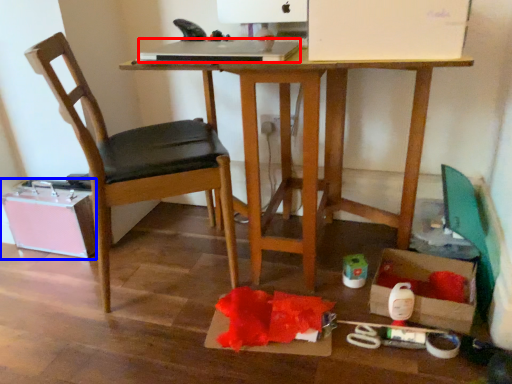
Question: Which object is further to the camera taking this photo, laptop (highlighted by a red box) or storage box (highlighted by a blue box)?

Choices:
 (A) laptop
 (B) storage box

Answer: (B)